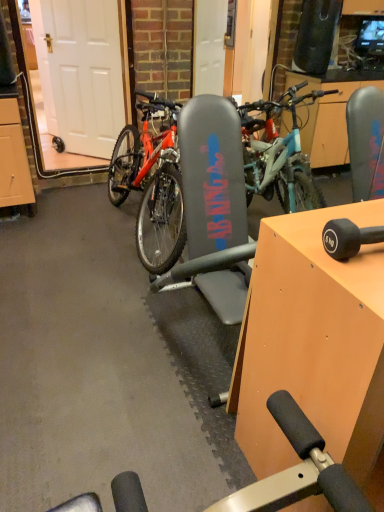
Question: Does orange wood table at center have a greater width compared to matte black bicycle at center?

Choices:
 (A) yes
 (B) no

Answer: (B)

Question: From a real-world perspective, is orange wood table at center located higher than matte black bicycle at center?

Choices:
 (A) yes
 (B) no

Answer: (B)

Question: Is orange wood table at center further to camera compared to matte black bicycle at center?

Choices:
 (A) yes
 (B) no

Answer: (B)

Question: Can you confirm if orange wood table at center is positioned to the right of matte black bicycle at center?

Choices:
 (A) yes
 (B) no

Answer: (A)

Question: Is orange wood table at center with matte black bicycle at center?

Choices:
 (A) yes
 (B) no

Answer: (B)

Question: Choose the correct answer: Is orange wood table at center inside matte black bicycle at center or outside it?

Choices:
 (A) outside
 (B) inside

Answer: (A)

Question: Visually, is orange wood table at center positioned to the left or to the right of matte black bicycle at center?

Choices:
 (A) right
 (B) left

Answer: (A)

Question: Is orange wood table at center in front of or behind matte black bicycle at center in the image?

Choices:
 (A) front
 (B) behind

Answer: (A)

Question: From the image's perspective, is orange wood table at center above or below matte black bicycle at center?

Choices:
 (A) above
 (B) below

Answer: (B)

Question: Is matte black bicycle at center to the left or to the right of orange wood table at center in the image?

Choices:
 (A) right
 (B) left

Answer: (B)

Question: Is matte black bicycle at center inside the boundaries of orange wood table at center, or outside?

Choices:
 (A) outside
 (B) inside

Answer: (A)

Question: In terms of width, does matte black bicycle at center look wider or thinner when compared to orange wood table at center?

Choices:
 (A) thin
 (B) wide

Answer: (B)

Question: From the image's perspective, relative to orange wood table at center, is matte black bicycle at center above or below?

Choices:
 (A) above
 (B) below

Answer: (A)

Question: In the image, is white matte door at left positioned in front of or behind orange wood table at center?

Choices:
 (A) behind
 (B) front

Answer: (A)

Question: Is white matte door at left situated inside orange wood table at center or outside?

Choices:
 (A) outside
 (B) inside

Answer: (A)